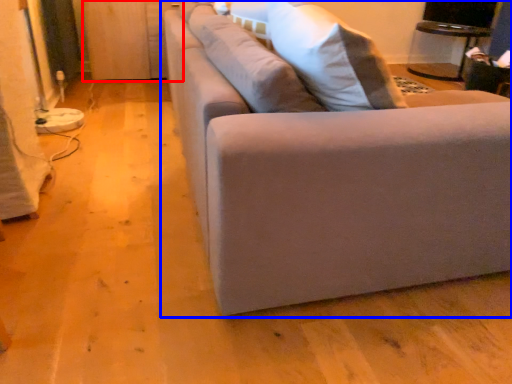
Question: Which object appears closest to the camera in this image, dresser (highlighted by a red box) or studio couch (highlighted by a blue box)?

Choices:
 (A) dresser
 (B) studio couch

Answer: (B)